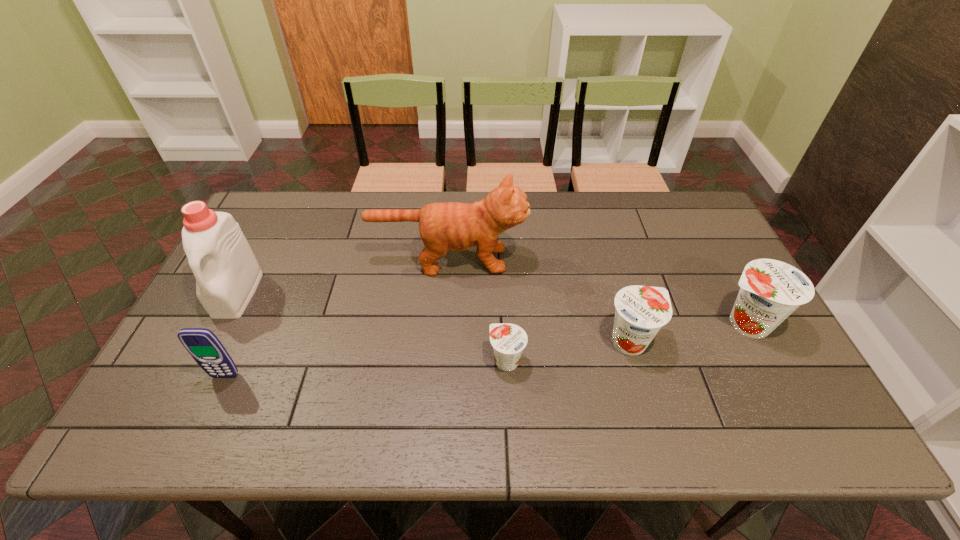
Where is `free space located 0.090m on the back of the rightmost yogurt`? free space located 0.090m on the back of the rightmost yogurt is located at coordinates (721, 278).

I want to click on vacant space located 0.150m on the handle side of the detergent, so click(199, 369).

This screenshot has width=960, height=540. I want to click on free spot located 0.200m on the face of the cat, so click(591, 260).

I want to click on yogurt located in the near edge section of the desktop, so click(508, 340).

The height and width of the screenshot is (540, 960). What are the coordinates of `cellular telephone present at the near edge` in the screenshot? It's located at (202, 344).

I want to click on detergent located at the left edge, so click(227, 273).

Locate an element on the screen. This screenshot has height=540, width=960. cellular telephone located at the left edge is located at coordinates (202, 344).

At what (x,y) coordinates should I click in order to perform the action: click on object located in the right edge section of the desktop. Please return your answer as a coordinate pair (x, y). Looking at the image, I should click on (771, 290).

Where is `object that is at the near left corner`? Image resolution: width=960 pixels, height=540 pixels. object that is at the near left corner is located at coordinates (202, 344).

This screenshot has width=960, height=540. In the image, there is a desktop. Find the location of `vacant space at the far edge`. vacant space at the far edge is located at coordinates (537, 202).